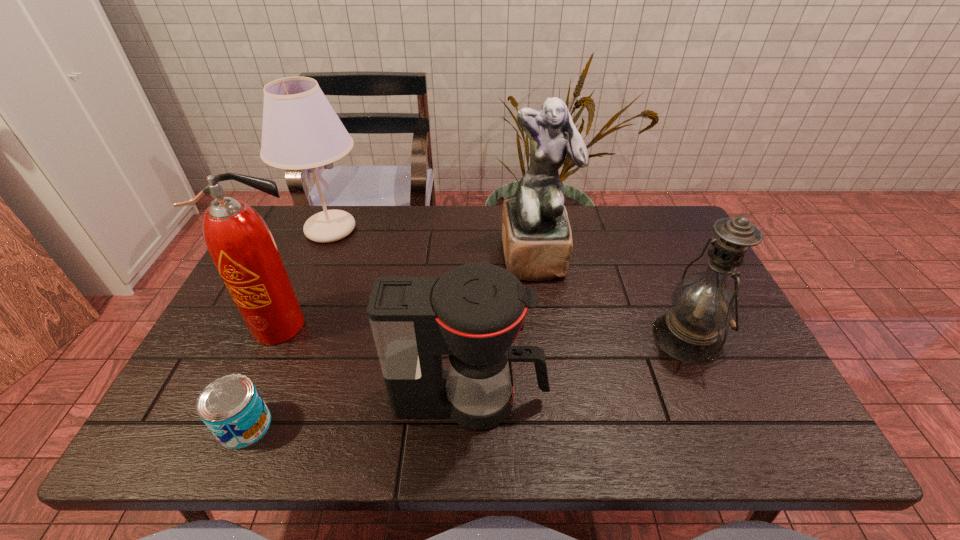
What are the coordinates of `free point located pour from the carafe of the coffee maker` in the screenshot? It's located at (693, 400).

This screenshot has width=960, height=540. What are the coordinates of `vacant position located 0.270m on the back of the shortest object` in the screenshot? It's located at (293, 312).

The width and height of the screenshot is (960, 540). I want to click on lampshade present at the far edge, so click(x=300, y=130).

At what (x,y) coordinates should I click in order to perform the action: click on sculpture situated at the far edge. Please return your answer as a coordinate pair (x, y). The width and height of the screenshot is (960, 540). Looking at the image, I should click on (537, 241).

Where is `coffee maker situated at the near edge`? This screenshot has height=540, width=960. coffee maker situated at the near edge is located at coordinates pos(473,313).

This screenshot has height=540, width=960. Find the location of `can at the near edge`. can at the near edge is located at coordinates (231, 407).

Image resolution: width=960 pixels, height=540 pixels. What are the coordinates of `lampshade at the left edge` in the screenshot? It's located at (300, 130).

In order to click on fire extinguisher located at the left edge in this screenshot , I will do click(x=241, y=245).

Find the location of a particular element. This screenshot has width=960, height=540. can present at the left edge is located at coordinates (231, 407).

This screenshot has height=540, width=960. I want to click on object situated at the right edge, so click(703, 303).